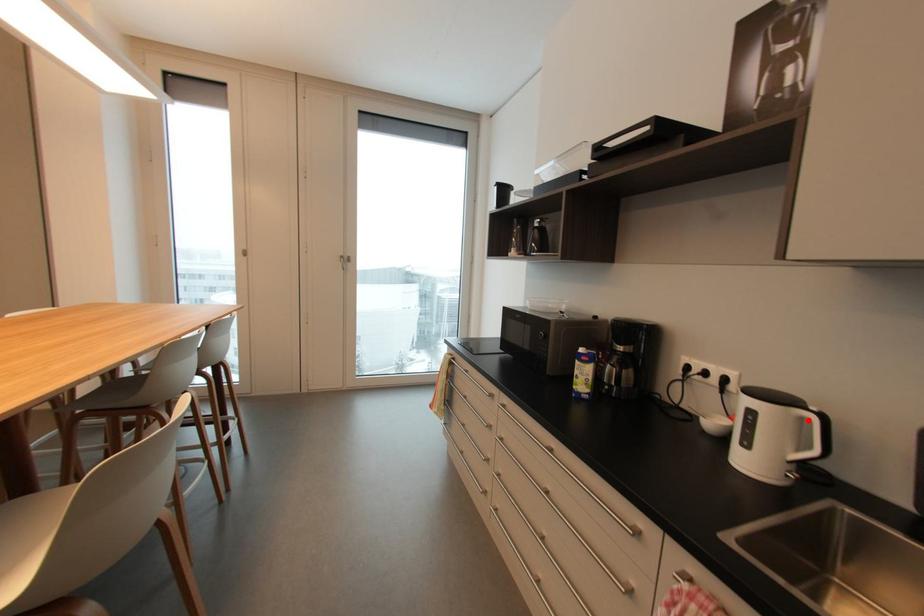
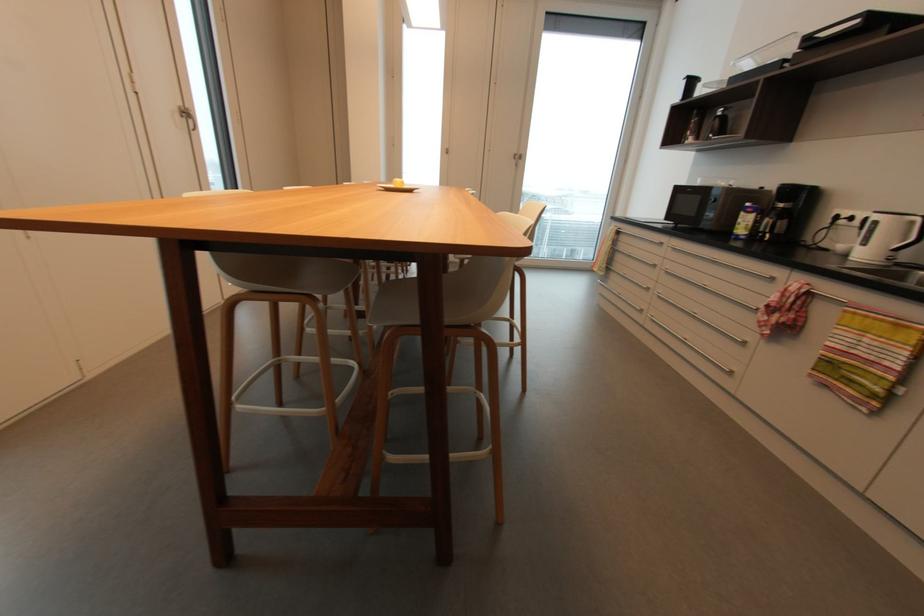
Locate, in the second image, the point that corresponds to the highlighted location in the first image.

(916, 223)